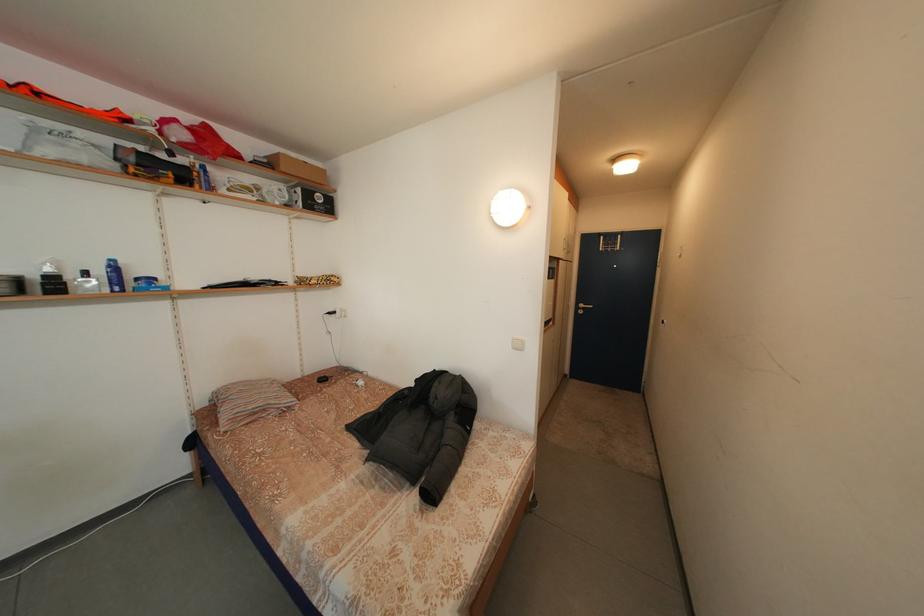
Locate an element on the screen. black pump dispenser is located at coordinates (312, 200).